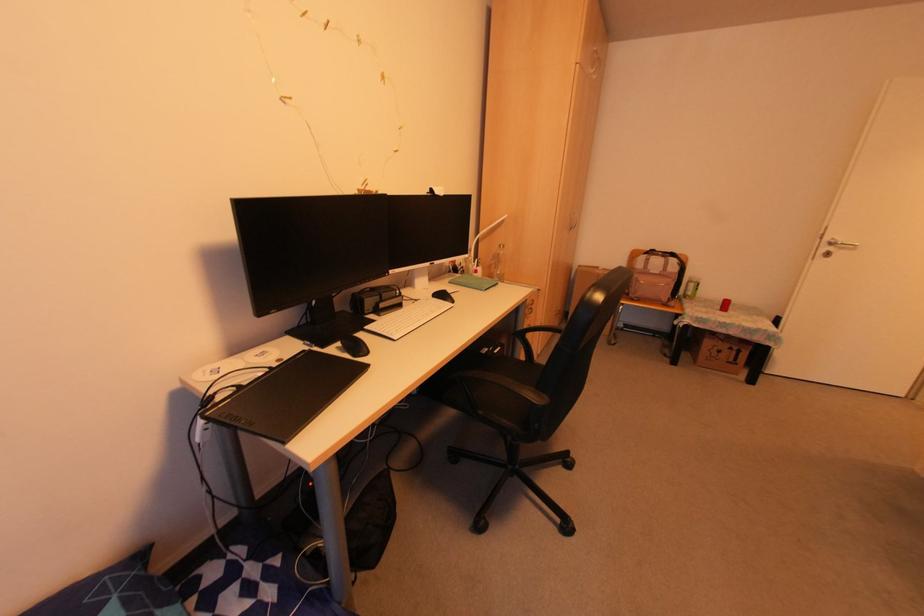
Find where to lift the clear water bottle. Please return your answer as a coordinate pair (x, y).

(497, 264)